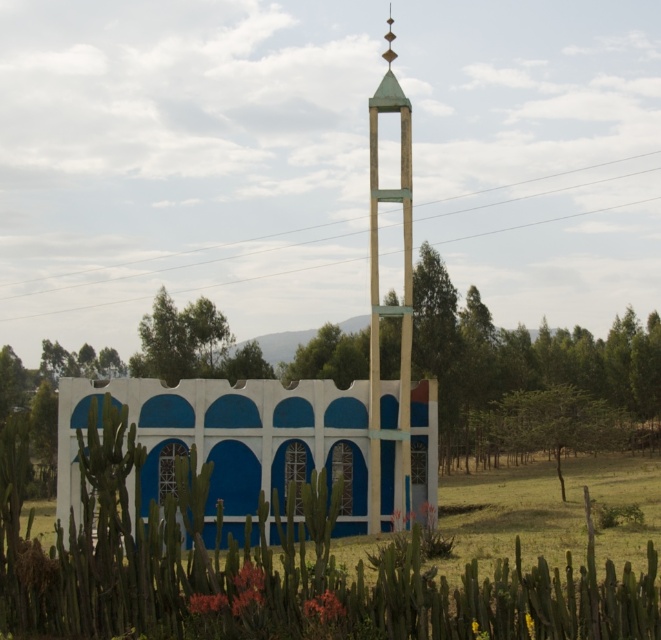
Between blue painted concrete wall at center and green matte tower at center, which one is positioned lower?

Positioned lower is blue painted concrete wall at center.

Between blue painted concrete wall at center and green matte tower at center, which one appears on the right side from the viewer's perspective?

Positioned to the right is green matte tower at center.

What do you see at coordinates (229, 440) in the screenshot? I see `blue painted concrete wall at center` at bounding box center [229, 440].

The image size is (661, 640). I want to click on blue painted concrete wall at center, so click(229, 440).

From the picture: Between green spiky cactus at center and blue painted concrete wall at center, which one appears on the left side from the viewer's perspective?

blue painted concrete wall at center

Does green spiky cactus at center appear on the right side of blue painted concrete wall at center?

Indeed, green spiky cactus at center is positioned on the right side of blue painted concrete wall at center.

This screenshot has width=661, height=640. Find the location of `green spiky cactus at center`. green spiky cactus at center is located at coordinates (268, 566).

Is green spiky cactus at center bigger than green matte tower at center?

Yes.

Is point (104, 580) less distant than point (401, 484)?

Yes, it is.

Find the location of a particular element. The image size is (661, 640). green spiky cactus at center is located at coordinates (268, 566).